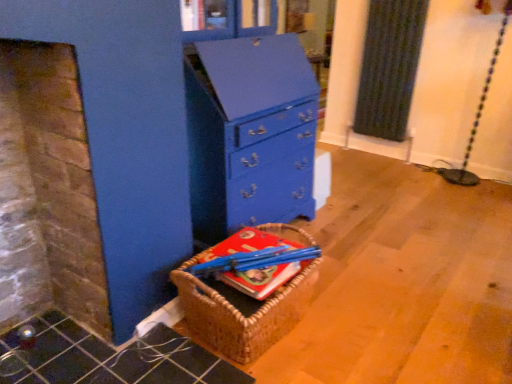
What is the approximate height of woven brown basket at lower left?

It is 13.31 inches.

At what (x,y) coordinates should I click in order to perform the action: click on blue painted wood chest of drawers at center. Please return your answer as a coordinate pair (x, y). This screenshot has height=384, width=512. Looking at the image, I should click on (249, 133).

I want to click on hardcover book at center, so click(x=254, y=261).

Considering the positions of objects hardcover book at center and blue painted wood chest of drawers at center in the image provided, who is more to the right, hardcover book at center or blue painted wood chest of drawers at center?

hardcover book at center is more to the right.

Is point (286, 277) in front of point (250, 212)?

That is True.

Is hardcover book at center positioned with its back to blue painted wood chest of drawers at center?

No, hardcover book at center is not facing the opposite direction of blue painted wood chest of drawers at center.

Considering the sizes of objects hardcover book at center and blue painted wood chest of drawers at center in the image provided, who is smaller, hardcover book at center or blue painted wood chest of drawers at center?

hardcover book at center.

Can you confirm if woven brown basket at lower left is shorter than hardcover book at center?

In fact, woven brown basket at lower left may be taller than hardcover book at center.

Does point (255, 354) come farther from viewer compared to point (263, 287)?

Yes.

Can you see woven brown basket at lower left touching hardcover book at center?

Yes.

Is woven brown basket at lower left positioned with its back to hardcover book at center?

No, hardcover book at center is not at the back of woven brown basket at lower left.

From the image's perspective, does hardcover book at center appear higher than woven brown basket at lower left?

Indeed, from the image's perspective, hardcover book at center is shown above woven brown basket at lower left.

Can woven brown basket at lower left be found inside hardcover book at center?

That's incorrect, woven brown basket at lower left is not inside hardcover book at center.

Who is more distant, hardcover book at center or woven brown basket at lower left?

hardcover book at center is further away from the camera.

Which object is wider, hardcover book at center or woven brown basket at lower left?

With larger width is woven brown basket at lower left.

Can you confirm if blue painted wood chest of drawers at center is positioned to the left of hardcover book at center?

Yes.

Does blue painted wood chest of drawers at center contain hardcover book at center?

Definitely not — hardcover book at center is not inside blue painted wood chest of drawers at center.

From a real-world perspective, which object stands above the other?

From a 3D spatial view, blue painted wood chest of drawers at center is above.

Consider the image. Is woven brown basket at lower left to the left or to the right of blue painted wood chest of drawers at center in the image?

In the image, woven brown basket at lower left appears on the right side of blue painted wood chest of drawers at center.

Considering the sizes of woven brown basket at lower left and blue painted wood chest of drawers at center in the image, is woven brown basket at lower left wider or thinner than blue painted wood chest of drawers at center?

In the image, woven brown basket at lower left appears to be more narrow than blue painted wood chest of drawers at center.

Does point (267, 326) appear closer or farther from the camera than point (214, 204)?

Point (267, 326).

Considering the positions of objects woven brown basket at lower left and blue painted wood chest of drawers at center in the image provided, who is in front, woven brown basket at lower left or blue painted wood chest of drawers at center?

Positioned in front is woven brown basket at lower left.

Considering the sizes of objects blue painted wood chest of drawers at center and woven brown basket at lower left in the image provided, who is bigger, blue painted wood chest of drawers at center or woven brown basket at lower left?

blue painted wood chest of drawers at center.

Is blue painted wood chest of drawers at center behind woven brown basket at lower left?

That is True.

From a real-world perspective, who is located lower, blue painted wood chest of drawers at center or woven brown basket at lower left?

From a 3D spatial view, woven brown basket at lower left is below.

This screenshot has height=384, width=512. There is a hardcover book at center. Find the location of `the chest of drawers above it (from a real-world perspective)`. the chest of drawers above it (from a real-world perspective) is located at coordinates (249, 133).

In order to click on basket in front of the hardcover book at center in this screenshot , I will do `click(242, 310)`.

Looking at the image, which one is located closer to hardcover book at center, woven brown basket at lower left or blue painted wood chest of drawers at center?

Based on the image, woven brown basket at lower left appears to be nearer to hardcover book at center.

Which object lies nearer to the anchor point hardcover book at center, blue painted wood chest of drawers at center or woven brown basket at lower left?

Among the two, woven brown basket at lower left is located nearer to hardcover book at center.

Estimate the real-world distances between objects in this image. Which object is further from woven brown basket at lower left, hardcover book at center or blue painted wood chest of drawers at center?

blue painted wood chest of drawers at center.

Considering their positions, is blue painted wood chest of drawers at center positioned closer to woven brown basket at lower left than hardcover book at center?

hardcover book at center is closer to woven brown basket at lower left.

Which object lies nearer to the anchor point blue painted wood chest of drawers at center, hardcover book at center or woven brown basket at lower left?

Among the two, hardcover book at center is located nearer to blue painted wood chest of drawers at center.

Estimate the real-world distances between objects in this image. Which object is closer to blue painted wood chest of drawers at center, woven brown basket at lower left or hardcover book at center?

hardcover book at center lies closer to blue painted wood chest of drawers at center than the other object.

Locate an element on the screen. This screenshot has height=384, width=512. book between blue painted wood chest of drawers at center and woven brown basket at lower left vertically is located at coordinates click(x=254, y=261).